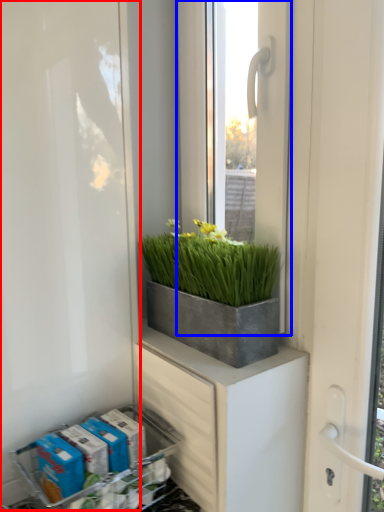
Question: Which point is further to the camera, screen door (highlighted by a red box) or window (highlighted by a blue box)?

Choices:
 (A) screen door
 (B) window

Answer: (B)